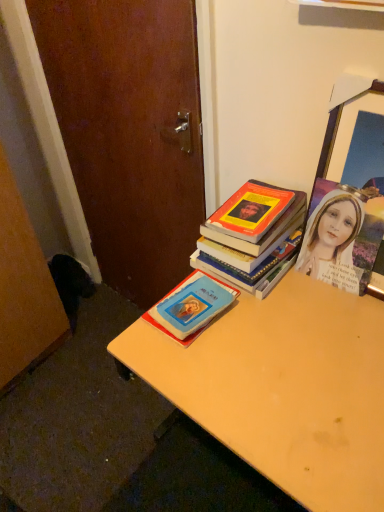
I want to click on wooden picture frame at upper right, so click(x=347, y=205).

Describe the element at coordinates (284, 388) in the screenshot. I see `light brown wooden desk at center` at that location.

Locate an element on the screen. wooden picture frame at upper right is located at coordinates (347, 205).

Which of these two, blue matte book at center, arranged as the second book when viewed from the top, or light brown wooden desk at center, stands shorter?

blue matte book at center, arranged as the second book when viewed from the top.

Is blue matte book at center, arranged as the second book when viewed from the top, positioned far away from light brown wooden desk at center?

They are positioned close to each other.

Is blue matte book at center, arranged as the second book when viewed from the top, positioned beyond the bounds of light brown wooden desk at center?

No, blue matte book at center, arranged as the second book when viewed from the top, is not entirely external to light brown wooden desk at center.

Considering the sizes of objects blue matte book at center, the first book ordered from the bottom, and wooden picture frame at upper right in the image provided, who is bigger, blue matte book at center, the first book ordered from the bottom, or wooden picture frame at upper right?

Bigger between the two is wooden picture frame at upper right.

Which of these two, blue matte book at center, arranged as the second book when viewed from the top, or wooden picture frame at upper right, stands taller?

With more height is wooden picture frame at upper right.

Which is behind, blue matte book at center, the first book ordered from the bottom, or wooden picture frame at upper right?

blue matte book at center, the first book ordered from the bottom, is further away from the camera.

Are blue matte book at center, arranged as the second book when viewed from the top, and wooden picture frame at upper right located far from each other?

No, blue matte book at center, arranged as the second book when viewed from the top, is not far from wooden picture frame at upper right.

Image resolution: width=384 pixels, height=512 pixels. I want to click on the 2nd book counting from the left side of the wooden picture frame at upper right, so click(x=191, y=307).

Between wooden picture frame at upper right and blue matte book at center, arranged as the second book when viewed from the top, which one has less height?

With less height is blue matte book at center, arranged as the second book when viewed from the top.

Looking at the image, does wooden picture frame at upper right seem bigger or smaller compared to blue matte book at center, arranged as the second book when viewed from the top?

Considering their sizes, wooden picture frame at upper right takes up more space than blue matte book at center, arranged as the second book when viewed from the top.

Based on the photo, from the image's perspective, which object appears higher, wooden picture frame at upper right or blue matte book at center, arranged as the second book when viewed from the top?

wooden picture frame at upper right.

Based on the photo, considering the relative sizes of light brown wooden desk at center and hardcover book at center, which ranks as the 1th book in top-to-bottom order, in the image provided, is light brown wooden desk at center taller than hardcover book at center, which ranks as the 1th book in top-to-bottom order,?

Correct, light brown wooden desk at center is much taller as hardcover book at center, which ranks as the 1th book in top-to-bottom order.

Does light brown wooden desk at center have a larger size compared to hardcover book at center, which is the second book from bottom to top?

Yes.

Considering the positions of objects light brown wooden desk at center and hardcover book at center, which ranks as the 1th book in top-to-bottom order, in the image provided, who is more to the left, light brown wooden desk at center or hardcover book at center, which ranks as the 1th book in top-to-bottom order,?

hardcover book at center, which ranks as the 1th book in top-to-bottom order, is more to the left.

Is point (190, 368) more distant than point (281, 252)?

No, it is in front of (281, 252).

Does light brown wooden desk at center come behind blue matte book at center, the first book ordered from the bottom?

No, light brown wooden desk at center is in front of blue matte book at center, the first book ordered from the bottom.

Is light brown wooden desk at center outside of blue matte book at center, the first book ordered from the bottom?

Yes.

Image resolution: width=384 pixels, height=512 pixels. I want to click on desk that appears on the right of blue matte book at center, the first book ordered from the bottom, so click(x=284, y=388).

From the picture: Is light brown wooden desk at center to the left of blue matte book at center, arranged as the second book when viewed from the top, from the viewer's perspective?

In fact, light brown wooden desk at center is to the right of blue matte book at center, arranged as the second book when viewed from the top.

From the picture: In terms of width, does hardcover book at center, which is the second book from bottom to top, look wider or thinner when compared to wooden picture frame at upper right?

In the image, hardcover book at center, which is the second book from bottom to top, appears to be wider than wooden picture frame at upper right.

From the picture: Is hardcover book at center, which is the second book from bottom to top, at the right side of wooden picture frame at upper right?

In fact, hardcover book at center, which is the second book from bottom to top, is to the left of wooden picture frame at upper right.

Is hardcover book at center, which ranks as the 1th book in top-to-bottom order, far from wooden picture frame at upper right?

That's not correct — hardcover book at center, which ranks as the 1th book in top-to-bottom order, is a little close to wooden picture frame at upper right.

Is wooden picture frame at upper right facing away from hardcover book at center, which is the second book from bottom to top?

wooden picture frame at upper right is not turned away from hardcover book at center, which is the second book from bottom to top.

Is point (340, 110) farther from viewer compared to point (231, 280)?

No, (340, 110) is closer to viewer.

From the image's perspective, which is below, wooden picture frame at upper right or hardcover book at center, which is the second book from bottom to top?

From the image's view, hardcover book at center, which is the second book from bottom to top, is below.

The width and height of the screenshot is (384, 512). I want to click on desk lying on the right of blue matte book at center, the first book ordered from the bottom, so click(284, 388).

Image resolution: width=384 pixels, height=512 pixels. In order to click on picture frame that appears above the blue matte book at center, the first book ordered from the bottom (from the image's perspective) in this screenshot , I will do `click(347, 205)`.

Based on the photo, based on their spatial positions, is blue matte book at center, the first book ordered from the bottom, or wooden picture frame at upper right closer to light brown wooden desk at center?

blue matte book at center, the first book ordered from the bottom, lies closer to light brown wooden desk at center than the other object.

Which object lies nearer to the anchor point light brown wooden desk at center, hardcover book at center, which is the second book from bottom to top, or blue matte book at center, the first book ordered from the bottom?

blue matte book at center, the first book ordered from the bottom, lies closer to light brown wooden desk at center than the other object.

In the scene shown: Estimate the real-world distances between objects in this image. Which object is closer to hardcover book at center, which ranks as the 1th book in top-to-bottom order, blue matte book at center, the first book ordered from the bottom, or light brown wooden desk at center?

blue matte book at center, the first book ordered from the bottom, is closer to hardcover book at center, which ranks as the 1th book in top-to-bottom order.

Based on their spatial positions, is hardcover book at center, which ranks as the 1th book in top-to-bottom order, or wooden picture frame at upper right further from blue matte book at center, the first book ordered from the bottom?

wooden picture frame at upper right is positioned further to the anchor blue matte book at center, the first book ordered from the bottom.

Looking at the image, which one is located closer to hardcover book at center, which ranks as the 1th book in top-to-bottom order, wooden picture frame at upper right or light brown wooden desk at center?

wooden picture frame at upper right.

Estimate the real-world distances between objects in this image. Which object is further from wooden picture frame at upper right, hardcover book at center, which ranks as the 1th book in top-to-bottom order, or blue matte book at center, arranged as the second book when viewed from the top?

blue matte book at center, arranged as the second book when viewed from the top, lies further to wooden picture frame at upper right than the other object.

When comparing their distances from hardcover book at center, which ranks as the 1th book in top-to-bottom order, does light brown wooden desk at center or blue matte book at center, arranged as the second book when viewed from the top, seem closer?

Based on the image, blue matte book at center, arranged as the second book when viewed from the top, appears to be nearer to hardcover book at center, which ranks as the 1th book in top-to-bottom order.

Looking at the image, which one is located further to light brown wooden desk at center, hardcover book at center, which is the second book from bottom to top, or wooden picture frame at upper right?

Based on the image, wooden picture frame at upper right appears to be further to light brown wooden desk at center.

Locate an element on the screen. The height and width of the screenshot is (512, 384). book located between blue matte book at center, arranged as the second book when viewed from the top, and wooden picture frame at upper right in the left-right direction is located at coordinates (250, 254).

This screenshot has height=512, width=384. In order to click on book that lies between hardcover book at center, which is the second book from bottom to top, and light brown wooden desk at center from top to bottom in this screenshot , I will do `click(191, 307)`.